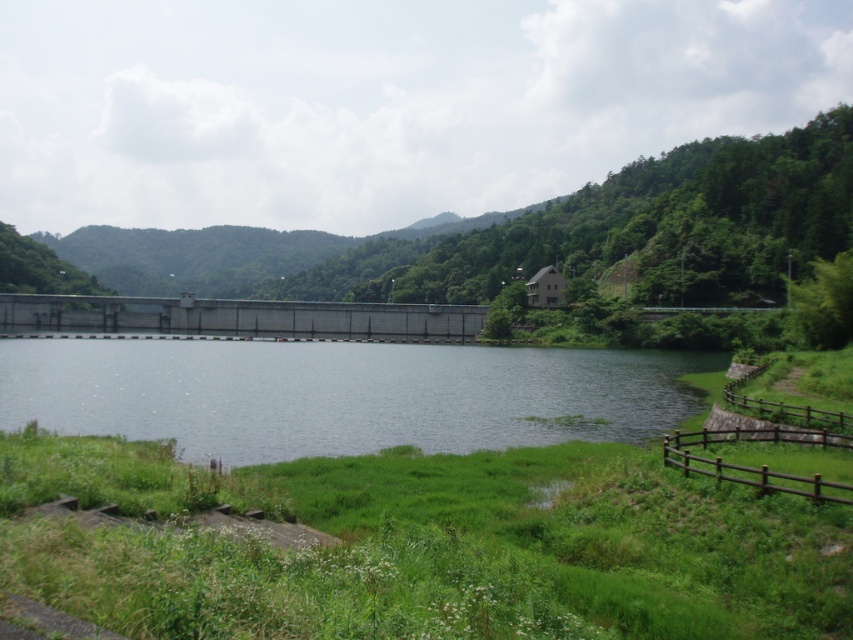
Question: Is clear water at center to the left of concrete dam at center from the viewer's perspective?

Choices:
 (A) yes
 (B) no

Answer: (B)

Question: Where is clear water at center located in relation to concrete dam at center in the image?

Choices:
 (A) right
 (B) left

Answer: (A)

Question: Does clear water at center appear on the left side of concrete dam at center?

Choices:
 (A) no
 (B) yes

Answer: (A)